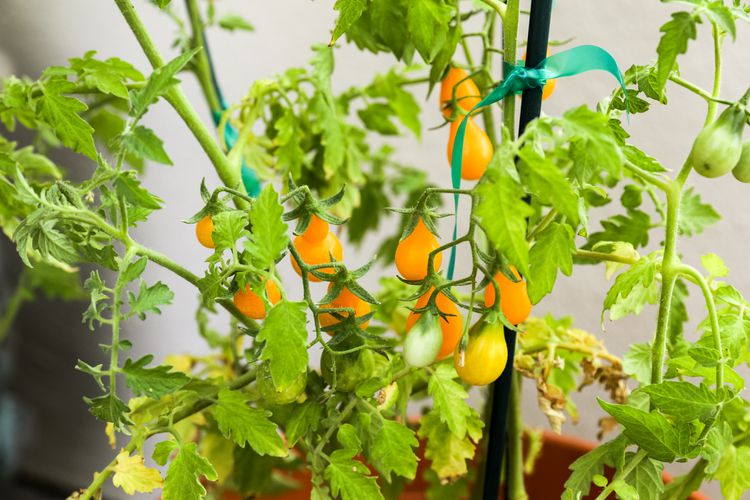
Locate an element on the screen. floor is located at coordinates (22, 492).